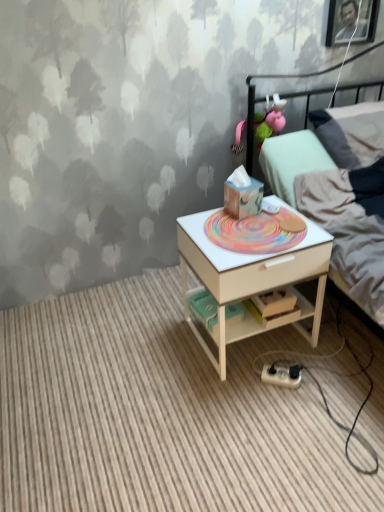
Question: Is light gray fabric bed at upper right with white wood desk at center?

Choices:
 (A) yes
 (B) no

Answer: (B)

Question: From a real-world perspective, is light gray fabric bed at upper right on top of white wood desk at center?

Choices:
 (A) yes
 (B) no

Answer: (A)

Question: Considering the relative positions of light gray fabric bed at upper right and white wood desk at center in the image provided, is light gray fabric bed at upper right to the right of white wood desk at center from the viewer's perspective?

Choices:
 (A) no
 (B) yes

Answer: (B)

Question: Is light gray fabric bed at upper right facing away from white wood desk at center?

Choices:
 (A) yes
 (B) no

Answer: (B)

Question: Is light gray fabric bed at upper right in front of white wood desk at center?

Choices:
 (A) yes
 (B) no

Answer: (B)

Question: Considering the positions of white wood nightstand at center and white wood desk at center in the image, is white wood nightstand at center wider or thinner than white wood desk at center?

Choices:
 (A) wide
 (B) thin

Answer: (A)

Question: In the image, is white wood nightstand at center positioned in front of or behind white wood desk at center?

Choices:
 (A) front
 (B) behind

Answer: (A)

Question: Is white wood nightstand at center bigger or smaller than white wood desk at center?

Choices:
 (A) big
 (B) small

Answer: (B)

Question: Does point click(x=339, y=470) appear closer or farther from the camera than point click(x=226, y=273)?

Choices:
 (A) farther
 (B) closer

Answer: (B)

Question: From a real-world perspective, is light gray fabric bed at upper right physically located above or below white plastic power strip at lower center?

Choices:
 (A) above
 (B) below

Answer: (A)

Question: Looking at the image, does light gray fabric bed at upper right seem bigger or smaller compared to white plastic power strip at lower center?

Choices:
 (A) big
 (B) small

Answer: (A)

Question: Is light gray fabric bed at upper right inside the boundaries of white plastic power strip at lower center, or outside?

Choices:
 (A) inside
 (B) outside

Answer: (B)

Question: Considering the positions of light gray fabric bed at upper right and white plastic power strip at lower center in the image, is light gray fabric bed at upper right taller or shorter than white plastic power strip at lower center?

Choices:
 (A) tall
 (B) short

Answer: (A)

Question: In terms of height, does white plastic power strip at lower center look taller or shorter compared to light gray fabric bed at upper right?

Choices:
 (A) short
 (B) tall

Answer: (A)

Question: Do you think white plastic power strip at lower center is within light gray fabric bed at upper right, or outside of it?

Choices:
 (A) inside
 (B) outside

Answer: (B)